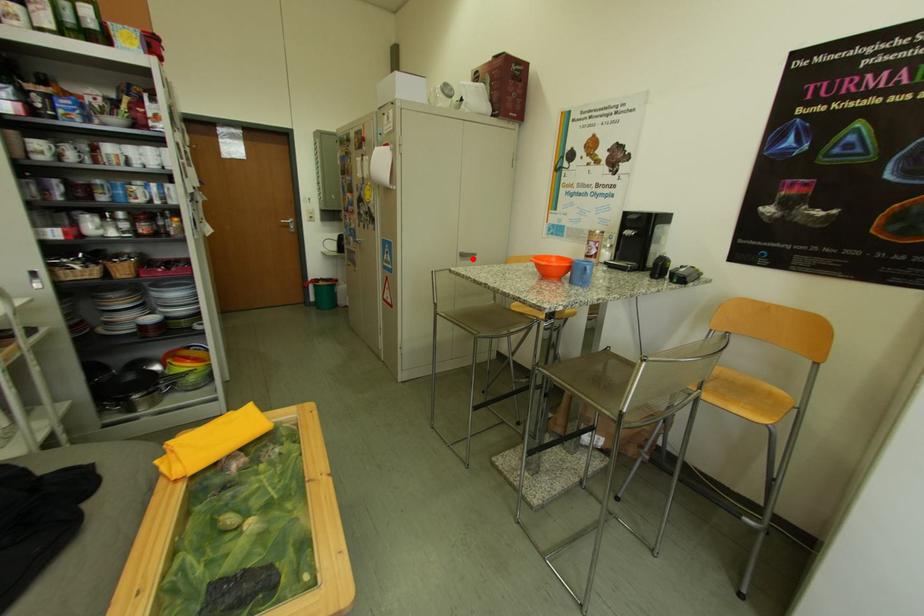
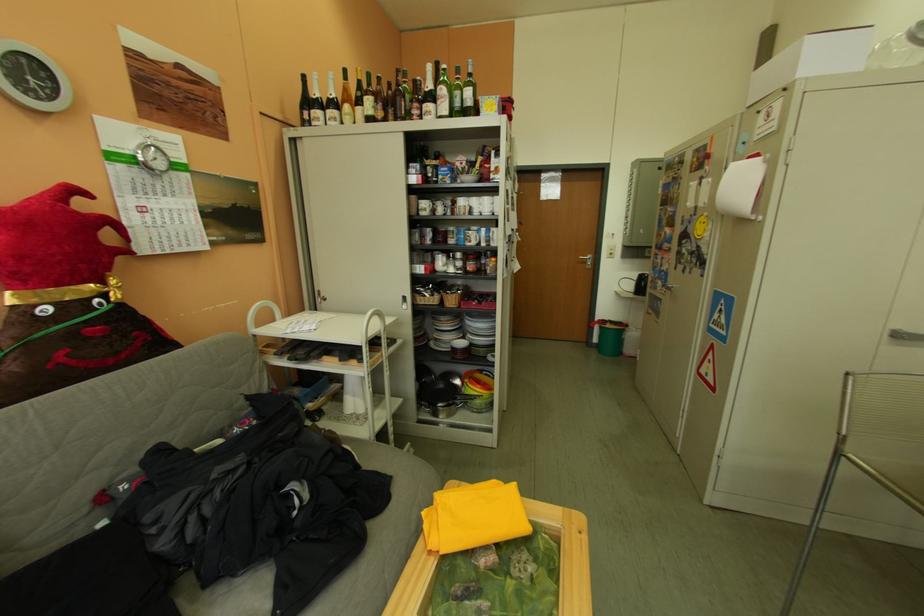
Question: I am providing you with two images of the same scene from different viewpoints. A red point is marked on the first image. At the location where the point appears in image 1, is it still visible in image 2?

Choices:
 (A) Yes
 (B) No

Answer: (A)